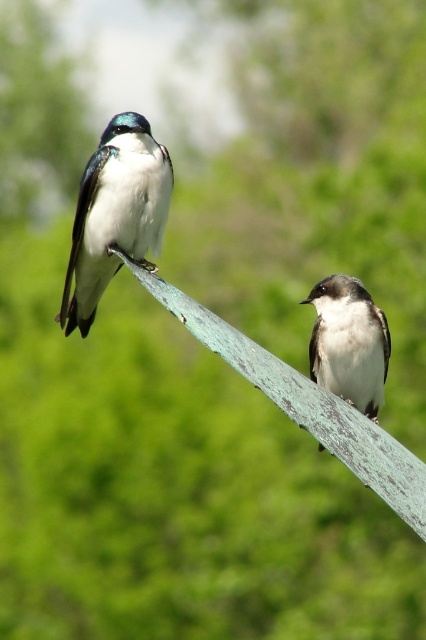
Question: Does shiny white bird at upper left lie in front of white matte bird at center?

Choices:
 (A) yes
 (B) no

Answer: (A)

Question: Which of the following is the farthest from the observer?

Choices:
 (A) white matte bird at center
 (B) shiny white bird at upper left

Answer: (A)

Question: Does shiny white bird at upper left have a greater width compared to white matte bird at center?

Choices:
 (A) yes
 (B) no

Answer: (A)

Question: Which object appears closest to the camera in this image?

Choices:
 (A) white matte bird at center
 (B) shiny white bird at upper left

Answer: (B)

Question: Can you confirm if shiny white bird at upper left is bigger than white matte bird at center?

Choices:
 (A) yes
 (B) no

Answer: (B)

Question: Which point appears closest to the camera in this image?

Choices:
 (A) (169, 205)
 (B) (371, 356)

Answer: (A)